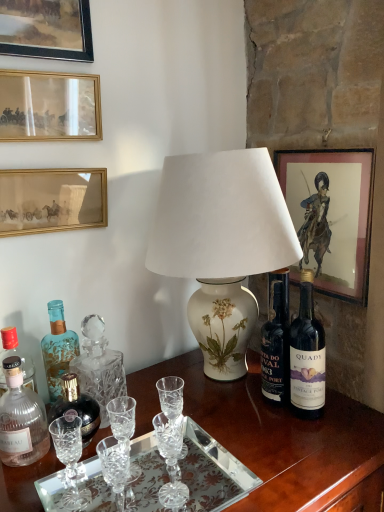
At what (x,y) coordinates should I click in order to perform the action: click on free spot to the left of dark glass bottle at right. Please return your answer as a coordinate pair (x, y). Looking at the image, I should click on (242, 417).